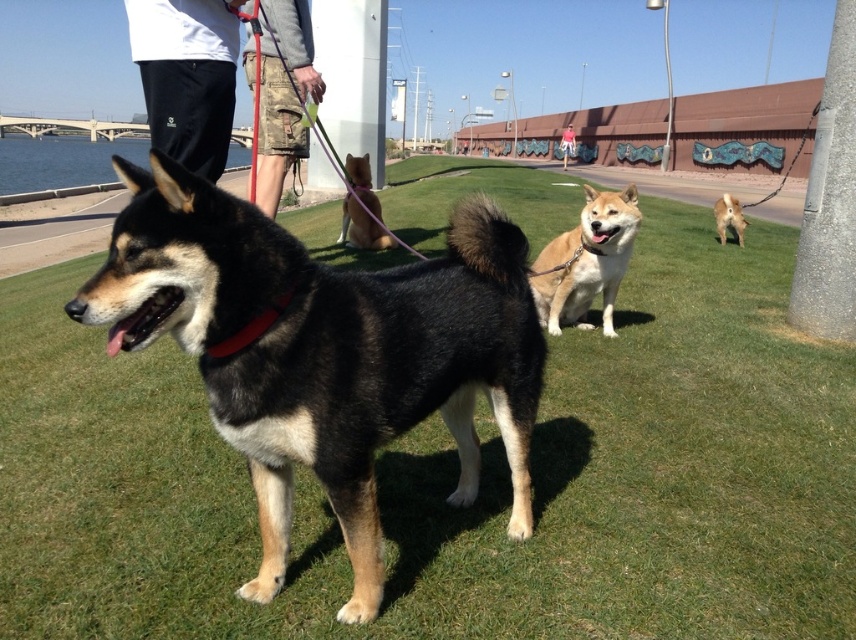
Between black cotton pants at upper left and red fabric collar at center, which one appears on the right side from the viewer's perspective?

Positioned to the right is red fabric collar at center.

Does black cotton pants at upper left lie in front of red fabric collar at center?

No, black cotton pants at upper left is further to the viewer.

Who is more forward, (146,83) or (300,276)?

Point (300,276) is in front.

Locate an element on the screen. The image size is (856, 640). black cotton pants at upper left is located at coordinates (187, 76).

Who is shorter, black fur dog at center or black cotton pants at upper left?

Standing shorter between the two is black cotton pants at upper left.

Does point (357, 380) come closer to viewer compared to point (188, 83)?

That is True.

The image size is (856, 640). What do you see at coordinates (325, 349) in the screenshot? I see `black fur dog at center` at bounding box center [325, 349].

Where is `black fur dog at center`? The width and height of the screenshot is (856, 640). black fur dog at center is located at coordinates (325, 349).

Can you confirm if black cotton pants at upper left is positioned below light brown fur at center?

No, black cotton pants at upper left is not below light brown fur at center.

Does black cotton pants at upper left have a greater width compared to light brown fur at center?

No, black cotton pants at upper left is not wider than light brown fur at center.

Does point (158, 97) lie in front of point (602, 202)?

Yes, it is.

Identify the location of black cotton pants at upper left. (187, 76).